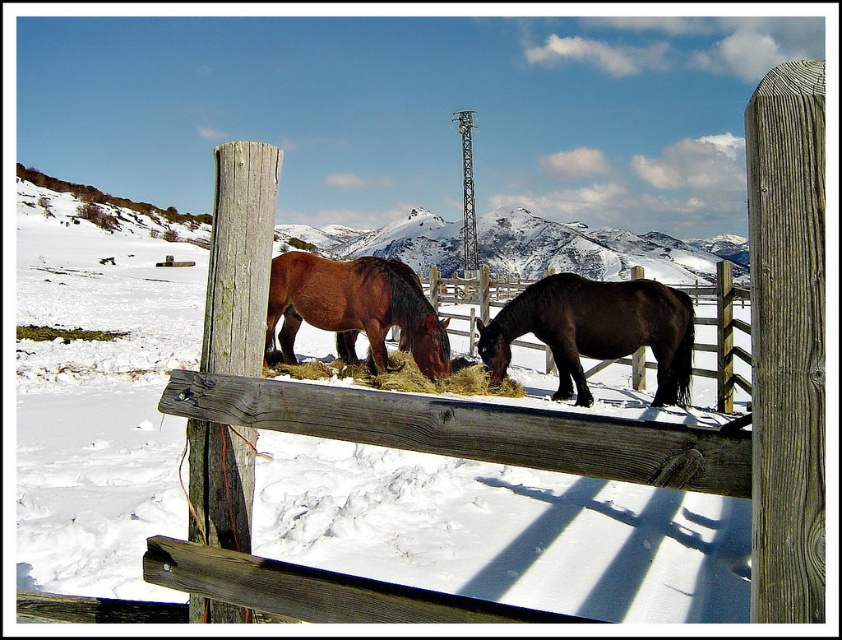
You are a photographer trying to capture a photo of the brown glossy horse at center without the weathered wood post at right appearing in the foreground. Based on the scene description, can you position yourself in a way to avoid the post blocking the horse?

The weathered wood post at right is much taller than the brown glossy horse at center. Since the post is taller, positioning yourself lower to the ground might allow you to frame the shot so the horse is visible while the post is out of frame or only partially visible.

You are a photographer wanting to capture the brown glossy horse at center and the golden straw at center in a photo. If you want to ensure both are fully visible, which object should you focus on first to avoid blurring due to their size difference?

The brown glossy horse at center is taller than the golden straw at center, so you should focus on the brown glossy horse at center first to ensure proper focus on the larger subject before adjusting for the smaller golden straw at center.